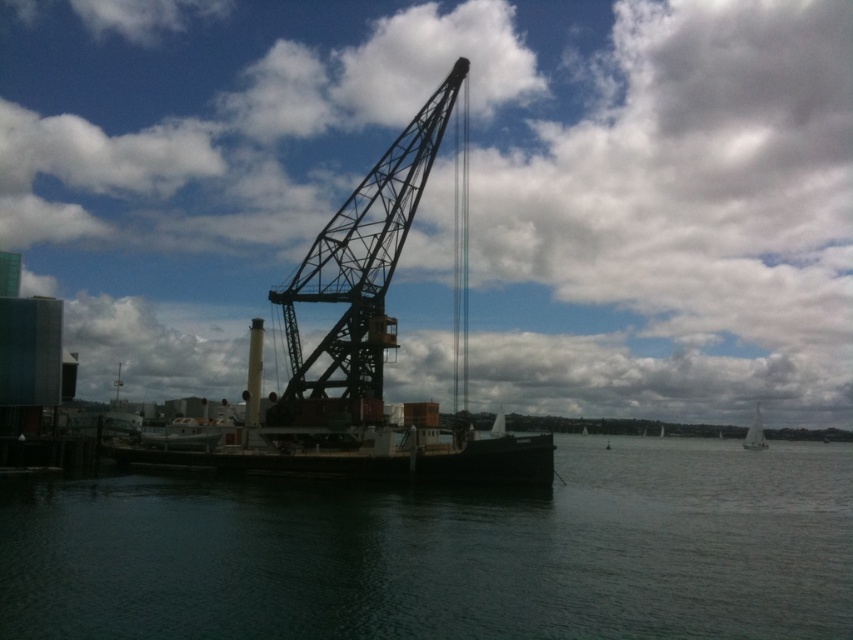
Does dark matte water at center appear under metallic industrial crane at center?

Yes.

Does point (606, 620) come in front of point (389, 280)?

Yes, it is in front of point (389, 280).

Identify the location of dark matte water at center. (447, 552).

At what (x,y) coordinates should I click in order to perform the action: click on dark matte water at center. Please return your answer as a coordinate pair (x, y). Image resolution: width=853 pixels, height=640 pixels. Looking at the image, I should click on (447, 552).

Who is more forward, (463, 349) or (746, 440)?

Positioned in front is point (463, 349).

Does metallic industrial crane at center have a smaller size compared to white sailboat at right?

No, metallic industrial crane at center is not smaller than white sailboat at right.

Between point (440, 472) and point (747, 433), which one is positioned behind?

Point (747, 433)

Identify the location of metallic industrial crane at center. (355, 353).

Does dark matte water at center appear over white sailboat at right?

No.

Is dark matte water at center bigger than white sailboat at right?

Yes, dark matte water at center is bigger than white sailboat at right.

Is point (20, 627) behind point (753, 435)?

No, it is in front of (753, 435).

Locate an element on the screen. The image size is (853, 640). dark matte water at center is located at coordinates (447, 552).